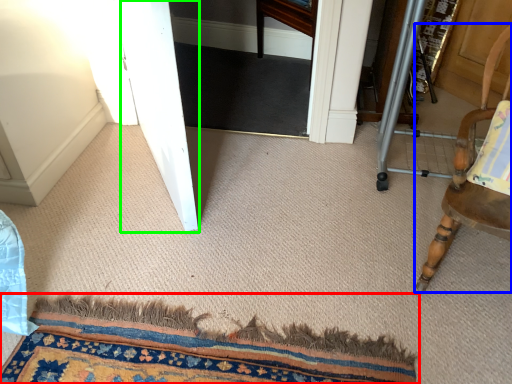
Question: Based on their relative distances, which object is farther from mat (highlighted by a red box)? Choose from chair (highlighted by a blue box) and screen door (highlighted by a green box).

Choices:
 (A) chair
 (B) screen door

Answer: (B)